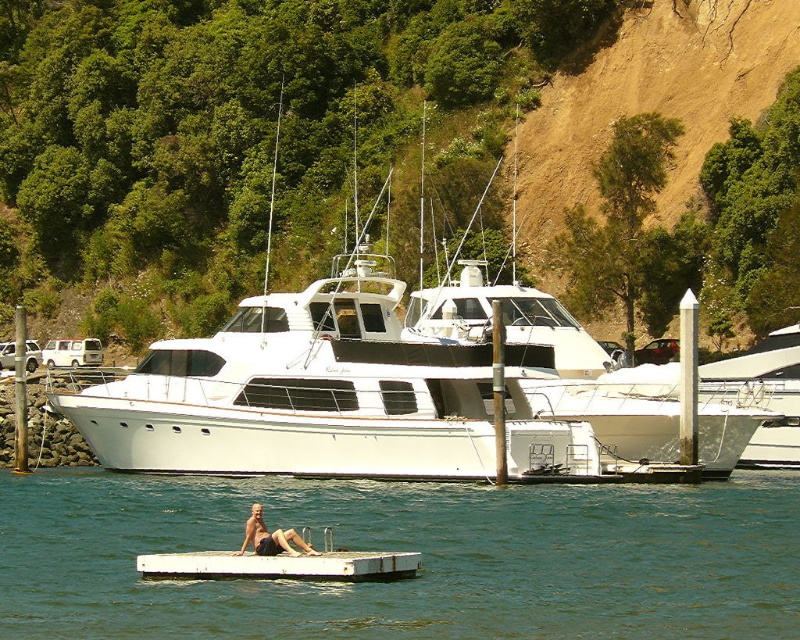
Based on the photo, you are standing at the marina and want to take a photo of the green leafy hillside at upper center. If your camera can focus up to 250 feet, will you be able to capture the hillside clearly?

The green leafy hillside at upper center is 260.56 feet away from the camera, which exceeds the camera focus limit of 250 feet. Therefore, the hillside will not be in clear focus.

You are a photographer planning to take a photo of the clear blue water at center and the smooth tan skin at lower center. Which object will appear closer to the camera in the final photo?

The clear blue water at center will appear closer to the camera in the final photo because it is in front of the smooth tan skin at lower center.

You are a swimmer who wants to reach the clear blue water at center from the smooth tan skin at lower center. Can you safely swim this distance without needing to stop?

The distance between the clear blue water at center and smooth tan skin at lower center is 6.32 meters. Since the swimmer can cover this distance without needing to stop, they can safely swim to the clear blue water at center.